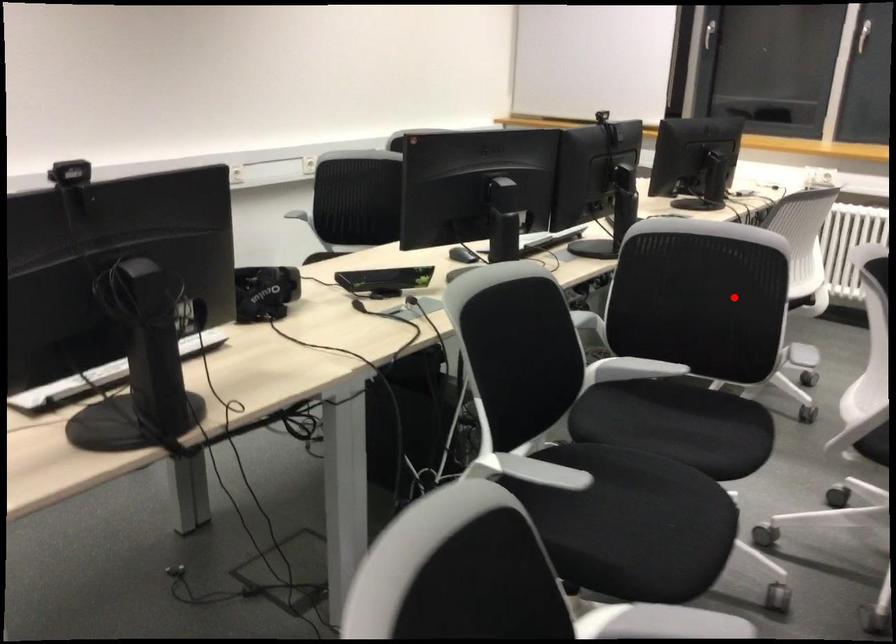
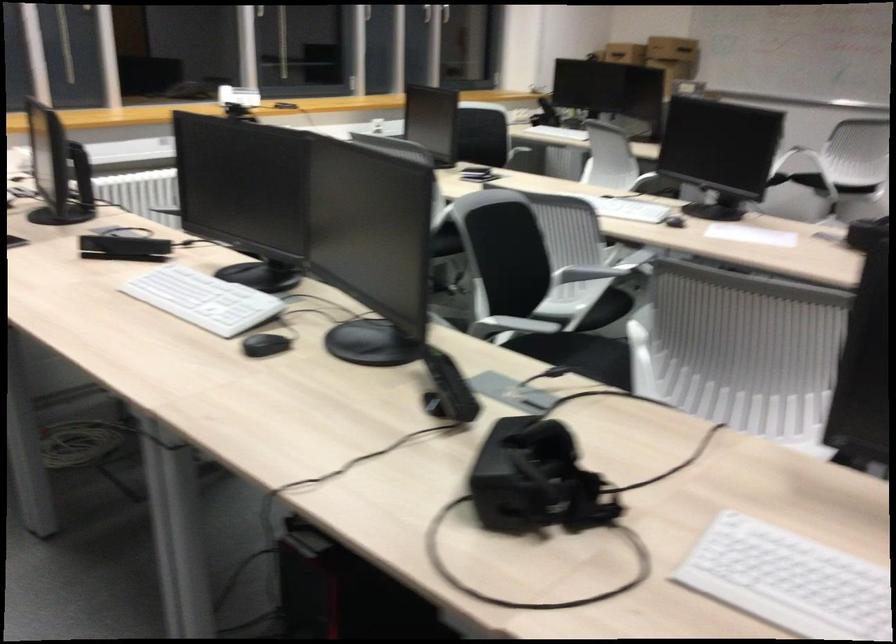
Question: A red point is marked in image1. In image2, is the corresponding 3D point closer to the camera or farther? Reply with the corresponding letter.

Choices:
 (A) The corresponding 3D point is closer.
 (B) The corresponding 3D point is farther.

Answer: (B)